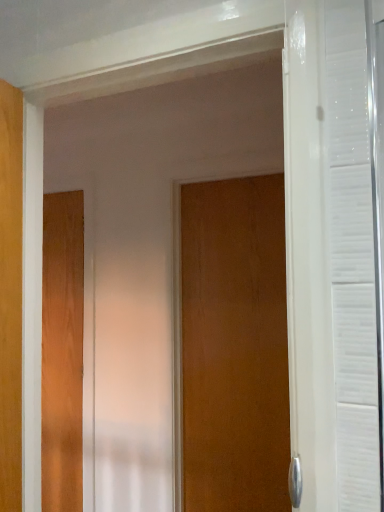
Where is `free space above wooden door at center, marked as the 1th door in a right-to-left arrangement (from a real-world perspective)`? free space above wooden door at center, marked as the 1th door in a right-to-left arrangement (from a real-world perspective) is located at coordinates (234, 172).